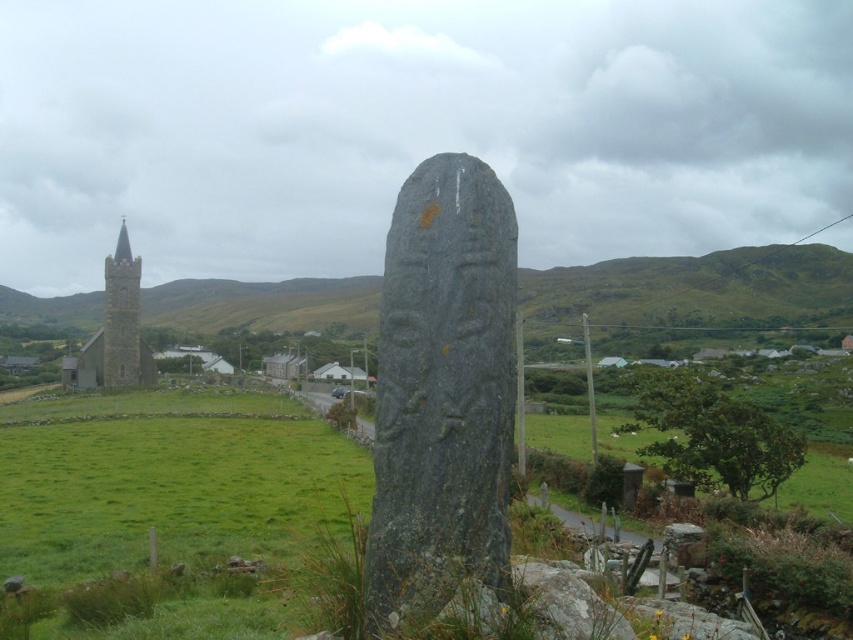
Is green grassy hillside at left below dark gray stone church at left?

Yes.

The height and width of the screenshot is (640, 853). I want to click on green grassy hillside at left, so click(694, 296).

Where is `green grassy hillside at left`? This screenshot has width=853, height=640. green grassy hillside at left is located at coordinates (694, 296).

Can you confirm if green grassy hillside at left is taller than smooth stone tower at left?

No, green grassy hillside at left is not taller than smooth stone tower at left.

Image resolution: width=853 pixels, height=640 pixels. What do you see at coordinates (694, 296) in the screenshot? I see `green grassy hillside at left` at bounding box center [694, 296].

At what (x,y) coordinates should I click in order to perform the action: click on green grassy hillside at left. Please return your answer as a coordinate pair (x, y). Image resolution: width=853 pixels, height=640 pixels. Looking at the image, I should click on (694, 296).

From the picture: Which of these two, dark gray stone church at left or smooth stone tower at left, stands taller?

Standing taller between the two is smooth stone tower at left.

Looking at this image, how much distance is there between dark gray stone church at left and smooth stone tower at left?

33.28 inches

Between point (117, 352) and point (125, 266), which one is positioned behind?

Positioned behind is point (125, 266).

This screenshot has width=853, height=640. I want to click on dark gray stone church at left, so point(114,330).